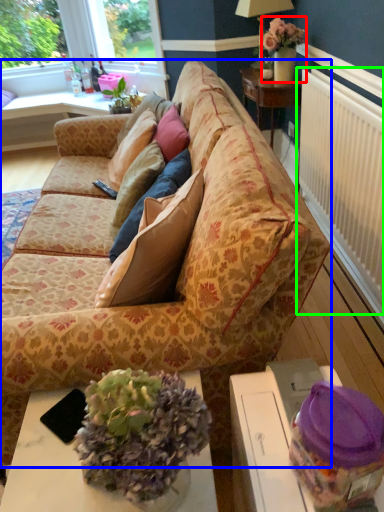
Question: Based on their relative distances, which object is farther from houseplant (highlighted by a red box)? Choose from studio couch (highlighted by a blue box) and radiator (highlighted by a green box).

Choices:
 (A) studio couch
 (B) radiator

Answer: (A)